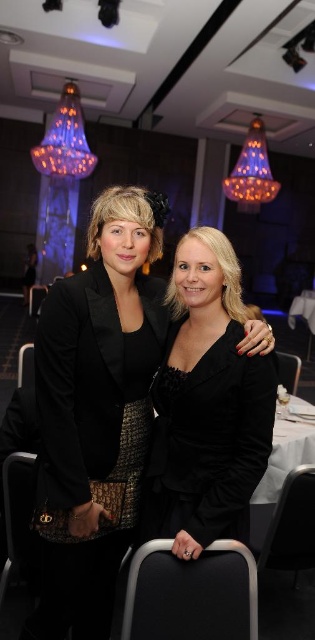
Question: Which object appears closest to the camera in this image?

Choices:
 (A) black velvet jacket at center
 (B) black velvet dress at center
 (C) black textured blazer at center

Answer: (A)

Question: Can you confirm if black velvet dress at center is positioned below black velvet jacket at center?

Choices:
 (A) yes
 (B) no

Answer: (A)

Question: Is black velvet dress at center positioned at the back of black textured blazer at center?

Choices:
 (A) yes
 (B) no

Answer: (A)

Question: Which object is farther from the camera taking this photo?

Choices:
 (A) black velvet dress at center
 (B) black textured blazer at center

Answer: (A)

Question: Can you confirm if black velvet dress at center is bigger than black velvet jacket at center?

Choices:
 (A) no
 (B) yes

Answer: (B)

Question: Among these objects, which one is nearest to the camera?

Choices:
 (A) black velvet jacket at center
 (B) black velvet dress at center

Answer: (A)